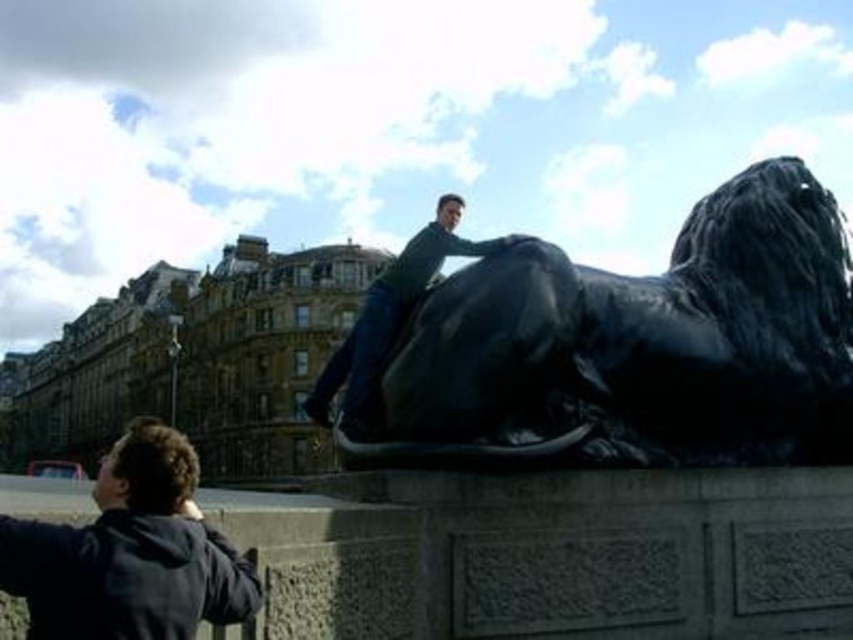
You are standing at the base of the statue and want to take a photo of the black polished stone lion at upper center and the matte black statue at center. Which direction should you turn to first to frame both in your camera?

You should turn to your right first because the black polished stone lion at upper center is located to the right of the matte black statue at center.

You are a photographer trying to capture a photo of the matte black statue at center. You notice the dark blue jacket at lower left might block the statue in your shot. Based on their heights, can the statue be seen behind the jacket?

The dark blue jacket at lower left has a greater height compared to matte black statue at center. Since the jacket is taller, it would likely block the view of the statue behind it.

You are an art conservator assessing the statues in the image. The black polished stone lion at upper center and the matte black statue at center are both made of the same material. Which statue has a smaller width?

The black polished stone lion at upper center is thinner than the matte black statue at center, so it has a smaller width.